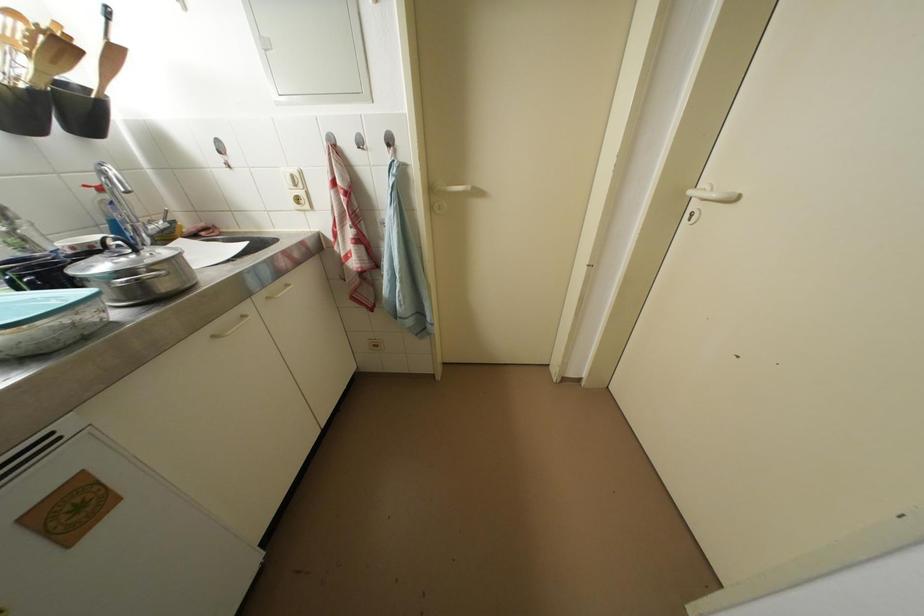
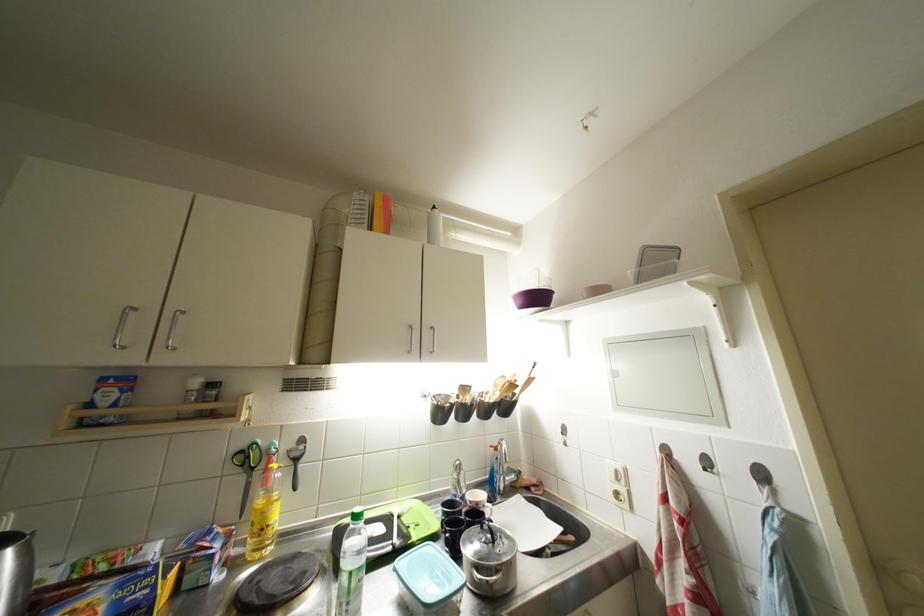
Find the pixel in the second image that matches [98,251] in the first image.

(483, 508)